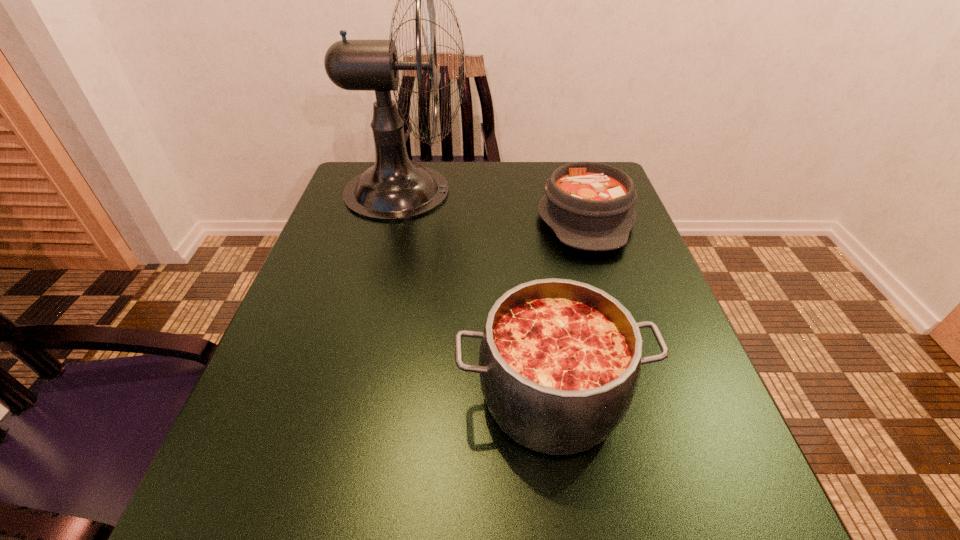
This screenshot has width=960, height=540. I want to click on object that is at the left edge, so click(x=394, y=188).

This screenshot has height=540, width=960. Identify the location of object present at the far left corner. (394, 188).

At what (x,y) coordinates should I click in order to perform the action: click on object located at the far right corner. Please return your answer as a coordinate pair (x, y). The width and height of the screenshot is (960, 540). Looking at the image, I should click on (589, 205).

Where is `free space at the far edge of the desktop`? free space at the far edge of the desktop is located at coordinates (517, 207).

Identify the location of free space at the near edge. The image size is (960, 540). (422, 526).

Locate an element on the screen. blank space at the left edge of the desktop is located at coordinates (328, 394).

This screenshot has width=960, height=540. Find the location of `free space at the right edge`. free space at the right edge is located at coordinates 679,448.

Locate an element on the screen. The image size is (960, 540). vacant area at the far left corner of the desktop is located at coordinates (366, 170).

This screenshot has height=540, width=960. In order to click on vacant space at the near right corner of the desktop in this screenshot , I will do `click(712, 500)`.

I want to click on free area in between the taller casserole and the tallest object, so click(478, 293).